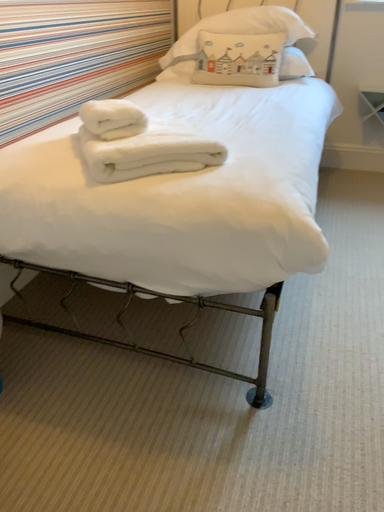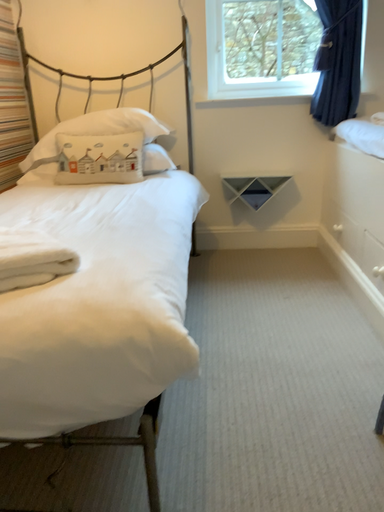
Question: How did the camera likely rotate when shooting the video?

Choices:
 (A) rotated downward
 (B) rotated upward

Answer: (B)